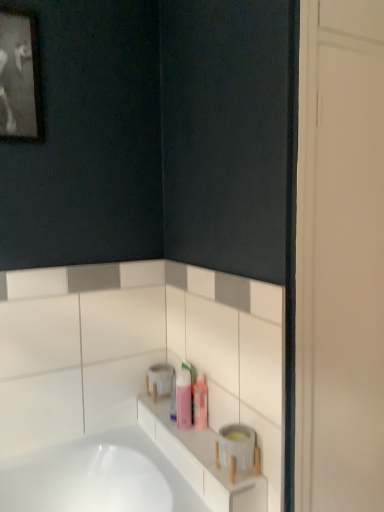
At what (x,y) coordinates should I click in order to perform the action: click on white matte toilet paper at upper center. Please return your answer as a coordinate pair (x, y). The width and height of the screenshot is (384, 512). Looking at the image, I should click on (161, 378).

This screenshot has width=384, height=512. Describe the element at coordinates (20, 77) in the screenshot. I see `black matte picture frame at upper left` at that location.

Where is `pink plastic bottle at center`? This screenshot has height=512, width=384. pink plastic bottle at center is located at coordinates pos(184,399).

Do you think black matte picture frame at upper left is within pink plastic bottle at center, or outside of it?

black matte picture frame at upper left is outside pink plastic bottle at center.

From the image's perspective, between black matte picture frame at upper left and pink plastic bottle at center, which one is located above?

black matte picture frame at upper left is shown above in the image.

Which object is further away from the camera, black matte picture frame at upper left or pink plastic bottle at center?

Positioned behind is pink plastic bottle at center.

How many degrees apart are the facing directions of white matte toilet paper at upper center and translucent plastic containers at lower center?

0.659 degrees.

Would you say white matte toilet paper at upper center is inside or outside translucent plastic containers at lower center?

white matte toilet paper at upper center is outside translucent plastic containers at lower center.

Find the location of a particular element. toilet paper behind the translucent plastic containers at lower center is located at coordinates (161, 378).

Which is more to the right, white matte toilet paper at upper center or translucent plastic containers at lower center?

translucent plastic containers at lower center.

Is point (165, 371) farther from viewer compared to point (190, 395)?

Yes, point (165, 371) is farther from viewer.

From a real-world perspective, which is physically above, white matte toilet paper at upper center or pink plastic bottle at center?

pink plastic bottle at center is physically above.

Is white matte toilet paper at upper center directly adjacent to pink plastic bottle at center?

white matte toilet paper at upper center and pink plastic bottle at center are clearly separated.

Is white matte toilet paper at upper center oriented towards pink plastic bottle at center?

No.

Find the location of a particular element. Image resolution: width=384 pixels, height=512 pixels. picture frame above the translucent plastic containers at lower center (from the image's perspective) is located at coordinates (20, 77).

Which is farther from the camera, [253,494] or [25,21]?

The point [25,21] is more distant.

From a real-world perspective, which is physically above, translucent plastic containers at lower center or black matte picture frame at upper left?

black matte picture frame at upper left.

Which object is closer to the camera, translucent plastic containers at lower center or black matte picture frame at upper left?

translucent plastic containers at lower center is closer to the camera.

Which of these two, pink plastic bottle at center or white matte toilet paper at upper center, is thinner?

pink plastic bottle at center.

Looking at this image, can you confirm if pink plastic bottle at center is taller than white matte toilet paper at upper center?

Yes.

Which object is further away from the camera, pink plastic bottle at center or white matte toilet paper at upper center?

white matte toilet paper at upper center is further away from the camera.

Is pink plastic bottle at center oriented towards white matte toilet paper at upper center?

No, pink plastic bottle at center is not oriented towards white matte toilet paper at upper center.

Which of these two, pink plastic bottle at center or black matte picture frame at upper left, stands shorter?

pink plastic bottle at center is shorter.

Between pink plastic bottle at center and black matte picture frame at upper left, which one appears on the left side from the viewer's perspective?

black matte picture frame at upper left.

From the image's perspective, is pink plastic bottle at center located above black matte picture frame at upper left?

Actually, pink plastic bottle at center appears below black matte picture frame at upper left in the image.

Is pink plastic bottle at center outside of black matte picture frame at upper left?

Yes.

Can you see pink plastic bottle at center touching translucent plastic containers at lower center?

No, pink plastic bottle at center is not next to translucent plastic containers at lower center.

Can you tell me how much pink plastic bottle at center and translucent plastic containers at lower center differ in facing direction?

There is a 0.0599-degree angle between the facing directions of pink plastic bottle at center and translucent plastic containers at lower center.

Is pink plastic bottle at center bigger than translucent plastic containers at lower center?

No, pink plastic bottle at center is not bigger than translucent plastic containers at lower center.

Is the depth of pink plastic bottle at center less than that of translucent plastic containers at lower center?

No.

Where is `toiletry on the right of black matte picture frame at upper left`? The image size is (384, 512). toiletry on the right of black matte picture frame at upper left is located at coordinates (184, 399).

Locate an element on the screen. counter top below the white matte toilet paper at upper center (from a real-world perspective) is located at coordinates (201, 462).

Which object lies further to the anchor point black matte picture frame at upper left, white matte toilet paper at upper center or pink plastic bottle at center?

pink plastic bottle at center lies further to black matte picture frame at upper left than the other object.

Which object lies nearer to the anchor point translucent plastic containers at lower center, black matte picture frame at upper left or pink plastic bottle at center?

Among the two, pink plastic bottle at center is located nearer to translucent plastic containers at lower center.

Based on their spatial positions, is black matte picture frame at upper left or translucent plastic containers at lower center closer to pink plastic bottle at center?

Among the two, translucent plastic containers at lower center is located nearer to pink plastic bottle at center.

Considering their positions, is black matte picture frame at upper left positioned further to translucent plastic containers at lower center than white matte toilet paper at upper center?

black matte picture frame at upper left is further to translucent plastic containers at lower center.

Estimate the real-world distances between objects in this image. Which object is further from black matte picture frame at upper left, pink plastic bottle at center or white matte toilet paper at upper center?

Among the two, pink plastic bottle at center is located further to black matte picture frame at upper left.

From the image, which object appears to be farther from black matte picture frame at upper left, white matte toilet paper at upper center or translucent plastic containers at lower center?

translucent plastic containers at lower center is further to black matte picture frame at upper left.

Looking at the image, which one is located further to translucent plastic containers at lower center, pink plastic bottle at center or white matte toilet paper at upper center?

white matte toilet paper at upper center.

Based on their spatial positions, is translucent plastic containers at lower center or pink plastic bottle at center further from white matte toilet paper at upper center?

Based on the image, translucent plastic containers at lower center appears to be further to white matte toilet paper at upper center.

At what (x,y) coordinates should I click in order to perform the action: click on toiletry positioned between translucent plastic containers at lower center and white matte toilet paper at upper center from near to far. Please return your answer as a coordinate pair (x, y). Looking at the image, I should click on (184, 399).

Identify the location of toiletry between black matte picture frame at upper left and white matte toilet paper at upper center vertically. (184, 399).

You are a GUI agent. You are given a task and a screenshot of the screen. Output one action in this format:
    pyautogui.click(x=<x>, y=<y>)
    Task: Click on the toilet paper between black matte picture frame at upper left and translucent plastic containers at lower center in the up-down direction
    
    Given the screenshot: What is the action you would take?
    pyautogui.click(x=161, y=378)

This screenshot has width=384, height=512. I want to click on toiletry between black matte picture frame at upper left and translucent plastic containers at lower center vertically, so click(184, 399).